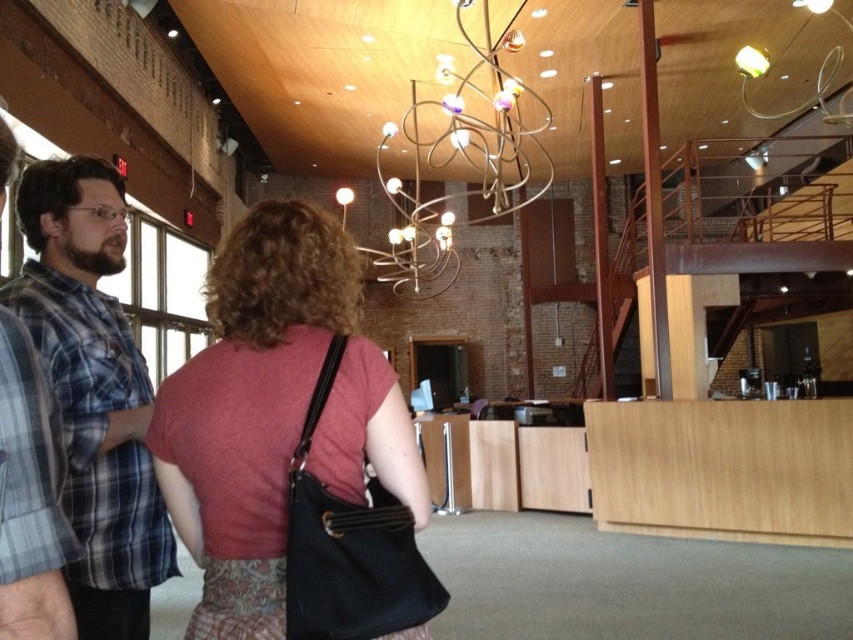
Question: Does blue plaid shirt at left come behind metallic wire chandelier at upper center?

Choices:
 (A) yes
 (B) no

Answer: (B)

Question: Can you confirm if blue plaid shirt at left is positioned to the right of metallic wire chandelier at upper center?

Choices:
 (A) no
 (B) yes

Answer: (A)

Question: Which point is closer to the camera?

Choices:
 (A) metallic wire chandelier at upper center
 (B) blue plaid shirt at left
 (C) plaid fabric shirt at left
 (D) matte black purse at center

Answer: (C)

Question: Which of the following is the closest to the observer?

Choices:
 (A) (521, 134)
 (B) (74, 595)
 (C) (209, 636)
 (D) (67, 611)

Answer: (D)

Question: Which point is closer to the camera?

Choices:
 (A) plaid fabric shirt at left
 (B) metallic wire chandelier at upper center

Answer: (A)

Question: Can you confirm if metallic wire chandelier at upper center is positioned to the right of plaid fabric shirt at left?

Choices:
 (A) yes
 (B) no

Answer: (A)